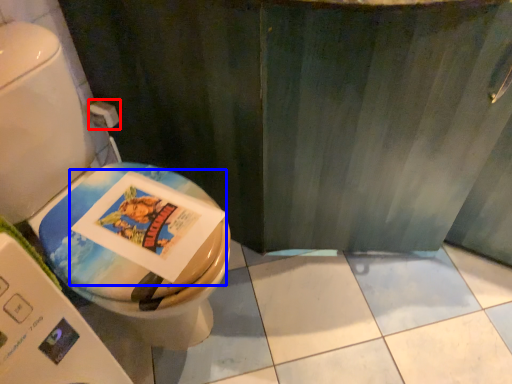
Question: Which of the following is the farthest to the observer, toilet paper (highlighted by a red box) or comic book (highlighted by a blue box)?

Choices:
 (A) toilet paper
 (B) comic book

Answer: (A)